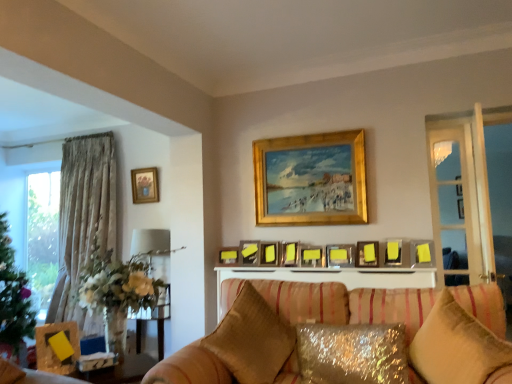
Question: From the image's perspective, is wooden picture frame at left, the 2th picture frame positioned from the left, located above or below yellow matte picture frame at center, the 10th picture frame when ordered from back to front?

Choices:
 (A) below
 (B) above

Answer: (A)

Question: Does point (57, 332) appear closer or farther from the camera than point (400, 253)?

Choices:
 (A) closer
 (B) farther

Answer: (A)

Question: Based on their relative distances, which object is nearer to the yellow matte picture frame at center, the 3th picture frame from the front?

Choices:
 (A) yellow matte picture frame at upper center, the 12th picture frame positioned from the left
 (B) gold wooden picture frame at upper center, which is counted as the sixth picture frame, starting from the right
 (C) gold-framed picture at upper left, marked as the twelfth picture frame in a right-to-left arrangement
 (D) wooden picture frame at left, which ranks as the 11th picture frame in right-to-left order
 (E) velvet beige pillow at lower right, the first pillow viewed from the right

Answer: (A)

Question: Which of these objects is positioned closest to the metallic silver picture frame at center, which ranks as the seventh picture frame in right-to-left order?

Choices:
 (A) sparkly gold pillow at lower center, the second pillow in the left-to-right sequence
 (B) wooden picture frame at left, which is counted as the first picture frame, starting from the front
 (C) gold-framed picture at upper left, acting as the 1th picture frame starting from the back
 (D) satin gold pillow at lower center, marked as the third pillow in a right-to-left arrangement
 (E) metallic silver picture frame at center, which is the 7th picture frame in front-to-back order

Answer: (E)